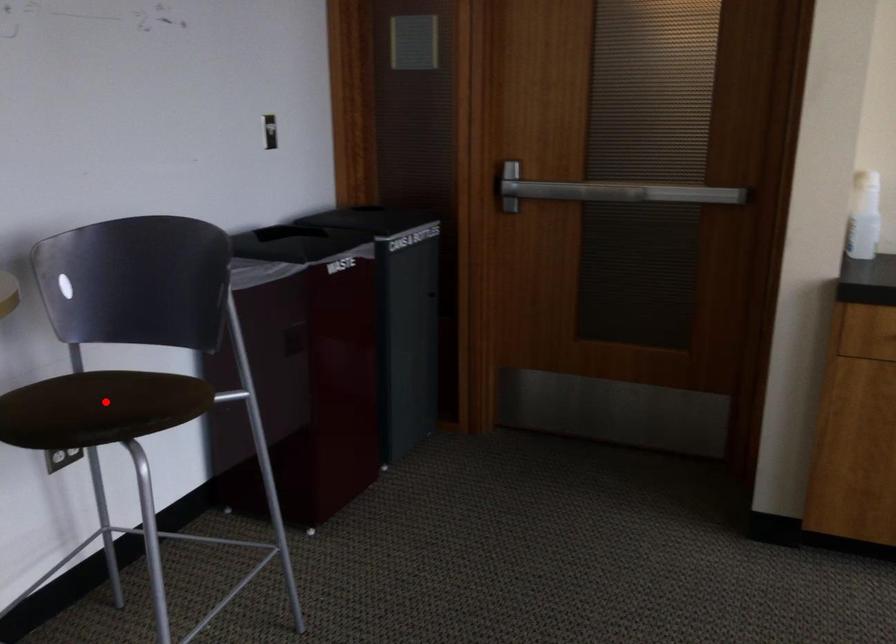
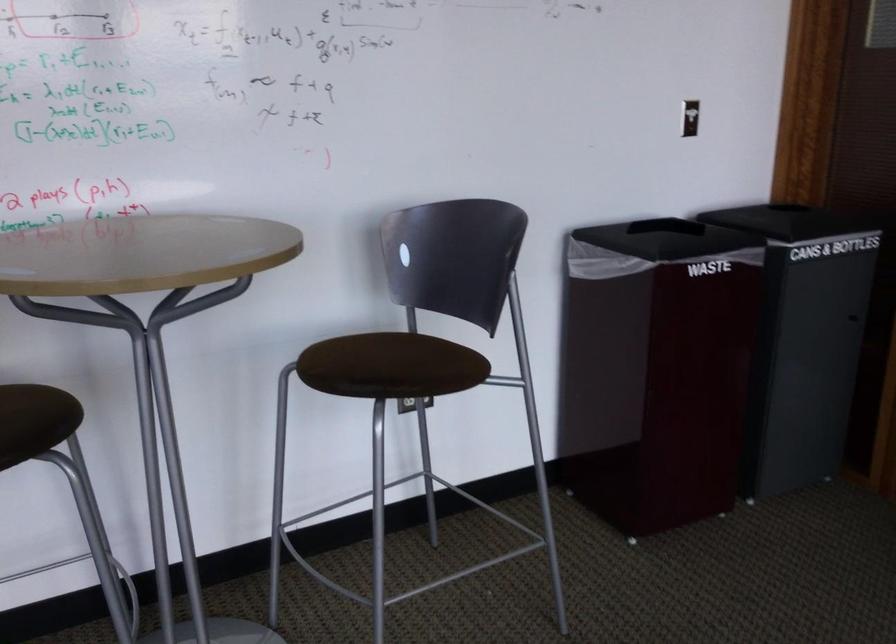
Question: I am providing you with two images of the same scene from different viewpoints. A red point is shown in image1. For the corresponding object point in image2, is it positioned nearer or farther from the camera?

Choices:
 (A) Nearer
 (B) Farther

Answer: (B)